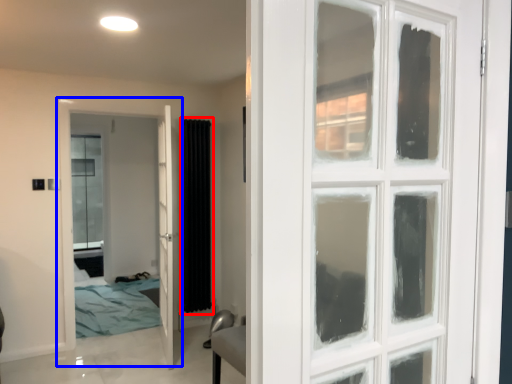
Question: Which of the following is the closest to the observer, curtain (highlighted by a red box) or door (highlighted by a blue box)?

Choices:
 (A) curtain
 (B) door

Answer: (B)